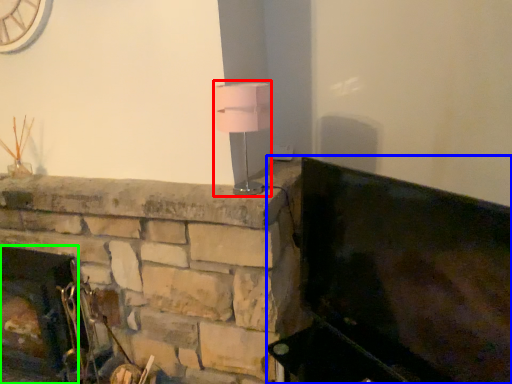
Question: Which is nearer to the table lamp (highlighted by a red box)? furniture (highlighted by a blue box) or fireplace (highlighted by a green box).

Choices:
 (A) furniture
 (B) fireplace

Answer: (A)